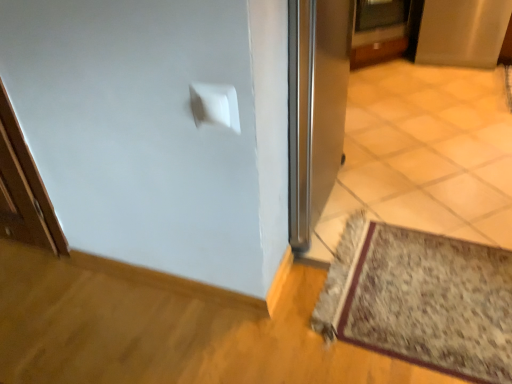
Question: Relative to metallic silver door at upper center, is satin silver screen door at upper right in front or behind?

Choices:
 (A) front
 (B) behind

Answer: (A)

Question: From a real-world perspective, is satin silver screen door at upper right above or below metallic silver door at upper center?

Choices:
 (A) below
 (B) above

Answer: (A)

Question: Estimate the real-world distances between objects in this image. Which object is closer to the satin silver screen door at upper right?

Choices:
 (A) floral carpet at lower right
 (B) metallic silver door at upper center

Answer: (B)

Question: Which of these objects is positioned closest to the floral carpet at lower right?

Choices:
 (A) satin silver screen door at upper right
 (B) metallic silver door at upper center

Answer: (B)